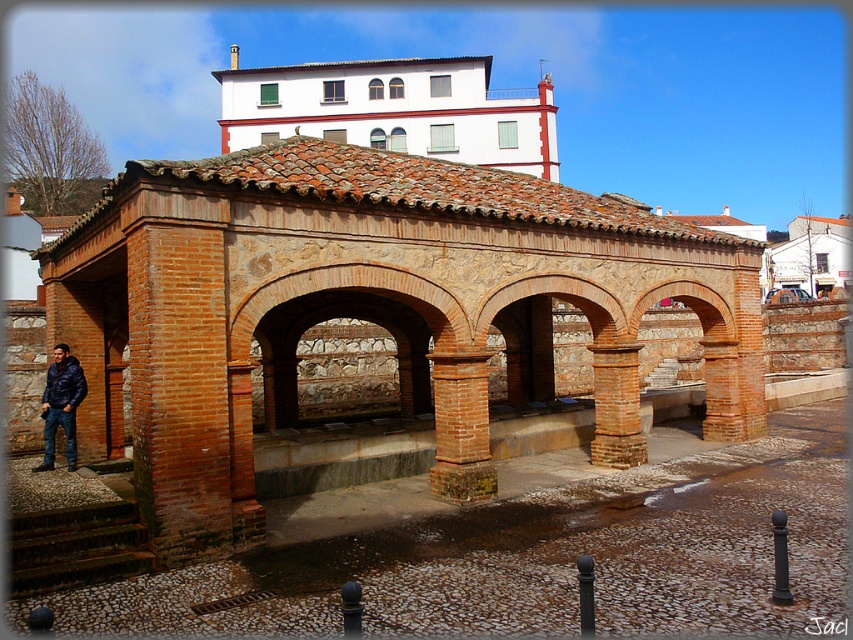
Question: Estimate the real-world distances between objects in this image. Which object is closer to the brick at center?

Choices:
 (A) brick column at center
 (B) dark blue leather jacket at lower left

Answer: (A)

Question: Does brick column at center come behind dark blue leather jacket at lower left?

Choices:
 (A) no
 (B) yes

Answer: (B)

Question: Is brick at center to the right of dark blue leather jacket at lower left from the viewer's perspective?

Choices:
 (A) no
 (B) yes

Answer: (B)

Question: Which point appears farthest from the camera in this image?

Choices:
 (A) (486, 460)
 (B) (596, 440)
 (C) (71, 376)

Answer: (B)

Question: Which object is the farthest from the brick at center?

Choices:
 (A) brick column at center
 (B) dark blue leather jacket at lower left

Answer: (B)

Question: In this image, where is brick at center located relative to dark blue leather jacket at lower left?

Choices:
 (A) left
 (B) right

Answer: (B)